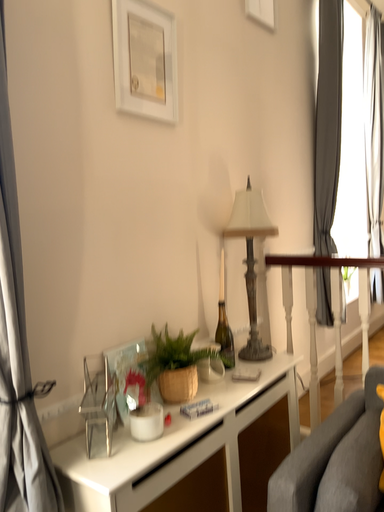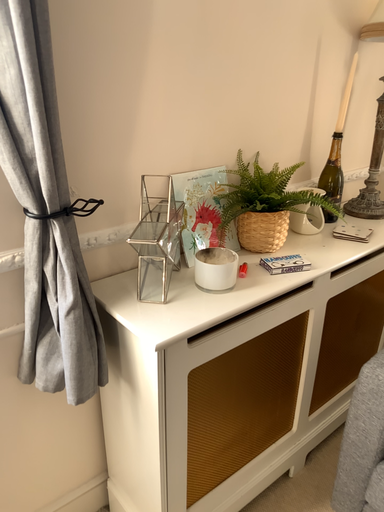
Question: Which way did the camera rotate in the video?

Choices:
 (A) rotated upward
 (B) rotated downward

Answer: (B)